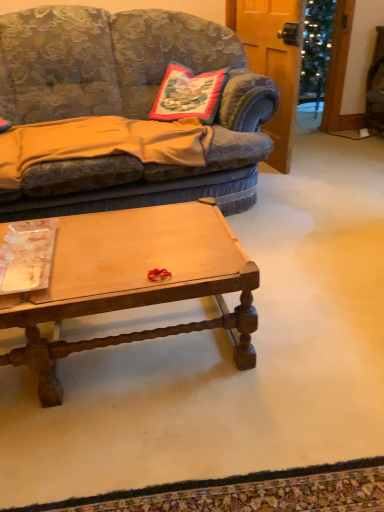
I want to click on vacant area located to the right-hand side of light brown wood coffee table at center, so [x=299, y=335].